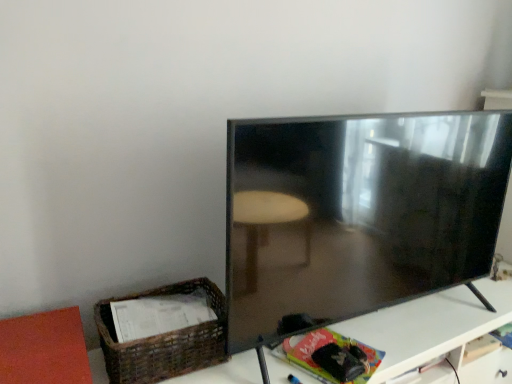
Question: Does woven brown basket at lower left have a smaller size compared to white glossy table at lower right?

Choices:
 (A) yes
 (B) no

Answer: (A)

Question: Can you confirm if woven brown basket at lower left is taller than white glossy table at lower right?

Choices:
 (A) yes
 (B) no

Answer: (B)

Question: Is woven brown basket at lower left not inside white glossy table at lower right?

Choices:
 (A) yes
 (B) no

Answer: (A)

Question: Does woven brown basket at lower left touch white glossy table at lower right?

Choices:
 (A) yes
 (B) no

Answer: (B)

Question: Considering the relative positions of woven brown basket at lower left and white glossy table at lower right in the image provided, is woven brown basket at lower left to the right of white glossy table at lower right from the viewer's perspective?

Choices:
 (A) yes
 (B) no

Answer: (B)

Question: Is matte black tv at right situated inside woven brown basket at lower left or outside?

Choices:
 (A) outside
 (B) inside

Answer: (A)

Question: Relative to woven brown basket at lower left, is matte black tv at right in front or behind?

Choices:
 (A) front
 (B) behind

Answer: (A)

Question: Considering the positions of point (281, 327) and point (200, 365), is point (281, 327) closer or farther from the camera than point (200, 365)?

Choices:
 (A) closer
 (B) farther

Answer: (B)

Question: From a real-world perspective, is matte black tv at right above or below woven brown basket at lower left?

Choices:
 (A) above
 (B) below

Answer: (A)

Question: From a real-world perspective, relative to white glossy table at lower right, is matte black tv at right vertically above or below?

Choices:
 (A) above
 (B) below

Answer: (A)

Question: Is matte black tv at right wider or thinner than white glossy table at lower right?

Choices:
 (A) wide
 (B) thin

Answer: (B)

Question: Is matte black tv at right inside or outside of white glossy table at lower right?

Choices:
 (A) inside
 (B) outside

Answer: (B)

Question: From their relative heights in the image, would you say matte black tv at right is taller or shorter than white glossy table at lower right?

Choices:
 (A) short
 (B) tall

Answer: (B)

Question: In the image, is white glossy table at lower right positioned in front of or behind matte black tv at right?

Choices:
 (A) front
 (B) behind

Answer: (B)

Question: Considering the positions of white glossy table at lower right and matte black tv at right in the image, is white glossy table at lower right bigger or smaller than matte black tv at right?

Choices:
 (A) small
 (B) big

Answer: (B)